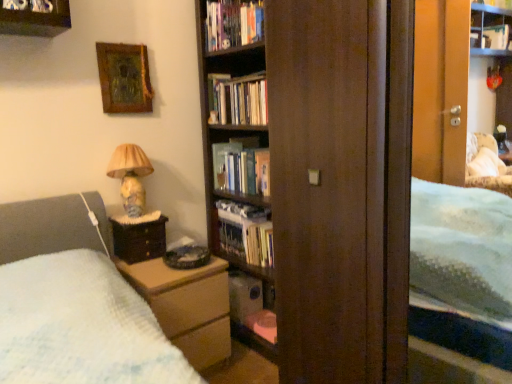
Locate an element on the screen. The width and height of the screenshot is (512, 384). vacant space situated above wooden chest of drawers at lower left (from a real-world perspective) is located at coordinates (157, 257).